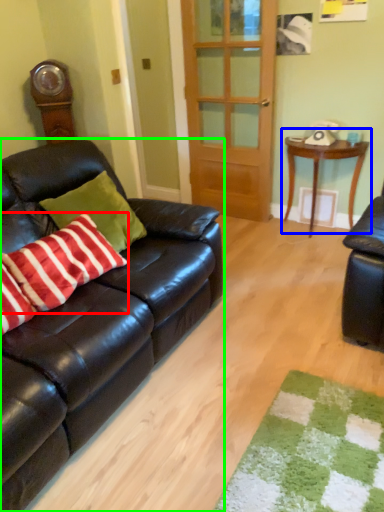
Question: Which is nearer to the pillow (highlighted by a red box)? table (highlighted by a blue box) or studio couch (highlighted by a green box).

Choices:
 (A) table
 (B) studio couch

Answer: (B)